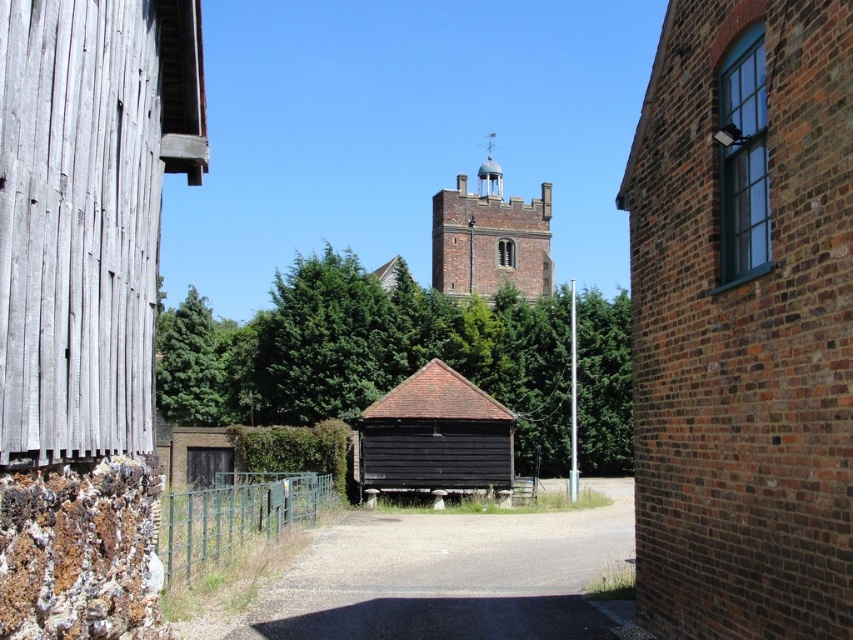
Question: Where is brick wall at right located in relation to smooth concrete alley at center in the image?

Choices:
 (A) below
 (B) above

Answer: (B)

Question: Which object appears farthest from the camera in this image?

Choices:
 (A) green wire fence at center
 (B) brick wall at right

Answer: (A)

Question: Which point appears closest to the camera in this image?

Choices:
 (A) coord(322,502)
 (B) coord(525,404)
 (C) coord(460,176)

Answer: (A)

Question: Does green leafy tree at center appear on the right side of green wire fence at center?

Choices:
 (A) yes
 (B) no

Answer: (B)

Question: Among these objects, which one is farthest from the camera?

Choices:
 (A) smooth concrete alley at center
 (B) dark brown wooden barn at center
 (C) green wire fence at center

Answer: (B)

Question: Can you confirm if smooth concrete alley at center is bigger than green wire fence at center?

Choices:
 (A) no
 (B) yes

Answer: (A)